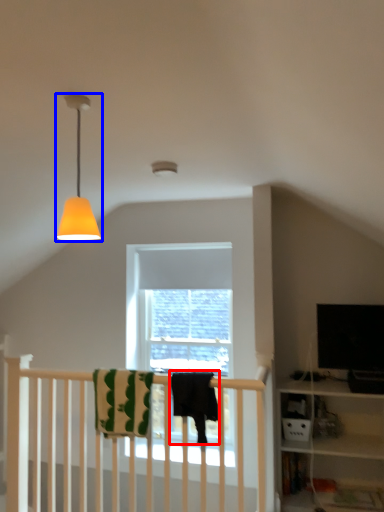
Question: Which object is closer to the camera taking this photo, beach towel (highlighted by a red box) or lamp (highlighted by a blue box)?

Choices:
 (A) beach towel
 (B) lamp

Answer: (B)